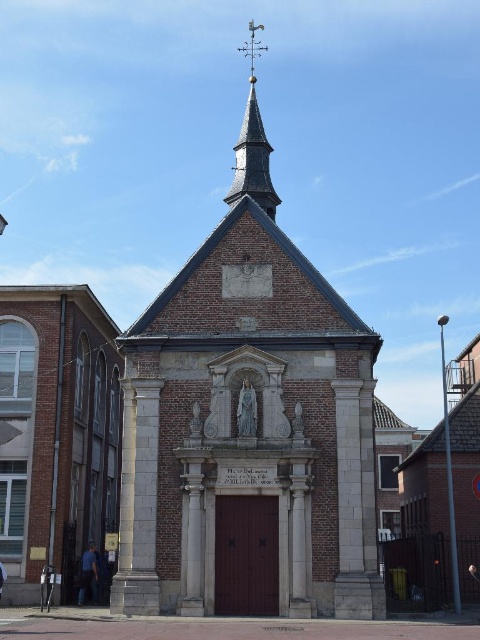
Question: Does white stone tower at center have a smaller size compared to smooth brown spire at upper center?

Choices:
 (A) no
 (B) yes

Answer: (A)

Question: Considering the relative positions of white stone tower at center and smooth brown spire at upper center in the image provided, where is white stone tower at center located with respect to smooth brown spire at upper center?

Choices:
 (A) left
 (B) right

Answer: (B)

Question: Among these points, which one is nearest to the camera?

Choices:
 (A) (365, 595)
 (B) (264, 138)

Answer: (A)

Question: Does white stone tower at center appear over smooth brown spire at upper center?

Choices:
 (A) no
 (B) yes

Answer: (A)

Question: Which object is farther from the camera taking this photo?

Choices:
 (A) smooth brown spire at upper center
 (B) white stone tower at center

Answer: (A)